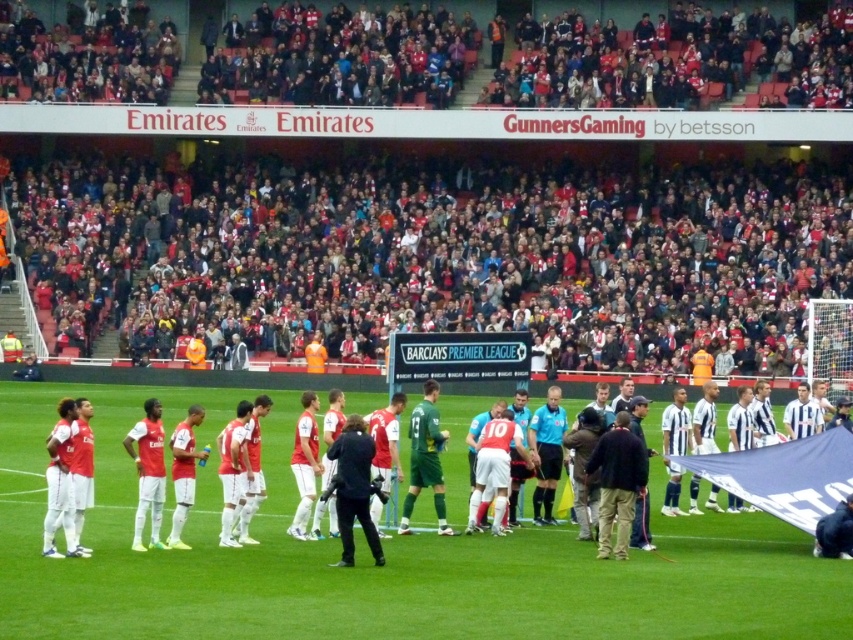
You are a photographer at the Emirates Stadium trying to capture a photo of the dark blue jacket at center and the green jersey at center. Since you want to ensure both are visible, which one should you focus on first to avoid blurring due to their size difference?

The dark blue jacket at center is shorter than the green jersey at center, so you should focus on the green jersey at center first as it is taller and might require more precise focusing to ensure clarity.

You are a photographer standing at the edge of the Emirates Stadium pitch. You want to take a photo that includes both the dark blue jacket at center and the green jersey at center. Which object should you focus on first to ensure both are in frame?

You should focus on the dark blue jacket at center first because it is larger in size compared to the green jersey at center, ensuring it fits within the frame while also capturing the smaller green jersey.

You are a photographer at the Emirates Stadium trying to capture a photo that includes both the red fabric crowd at upper center and the matte red jersey at left. Based on their positions, which object would appear larger in the photo?

The matte red jersey at left would appear larger in the photo because it is closer to the photographer than the red fabric crowd at upper center, which is further away.